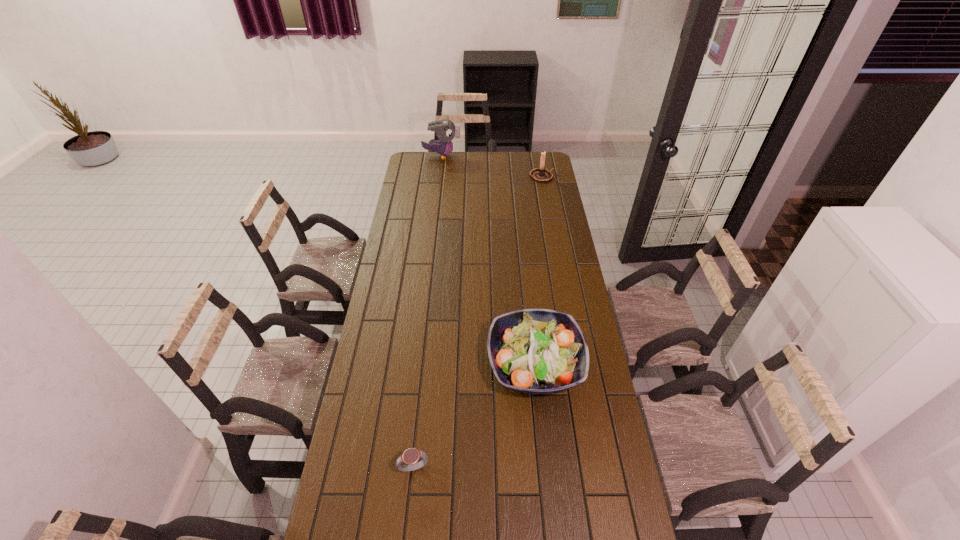
The image size is (960, 540). I want to click on free location that satisfies the following two spatial constraints: 1. at the beak of the bird; 2. on the back side of the shortest object, so click(404, 467).